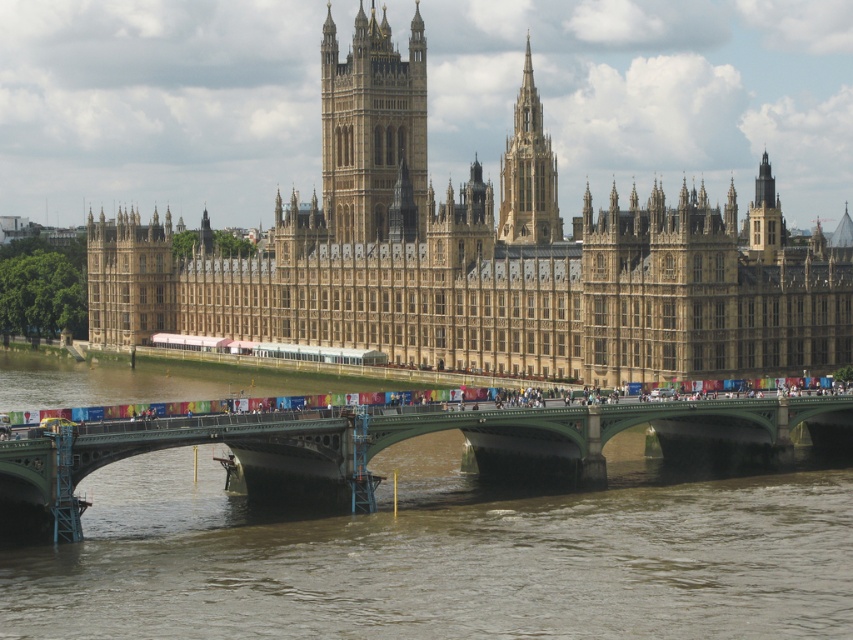
You are a tourist standing on the green metallic bridge at lower center, looking towards the golden stone tower at center. Which structure is wider from your perspective?

The green metallic bridge at lower center might be wider than golden stone tower at center according to the description.

You are standing on the green metallic bridge at lower center and want to look towards the golden stone spire at upper center. In which direction should you turn your head?

You should turn your head to the right because the green metallic bridge at lower center is to the left of the golden stone spire at upper center.

Based on the photo, you are standing on the green metallic bridge at lower center and want to take a photo of the golden stone tower at center. Since the bridge is lower, will you have to look up or down to frame the tower properly in your camera?

The green metallic bridge at lower center has a lesser height compared to golden stone tower at center, so you will have to look up to frame the tower properly in your camera.